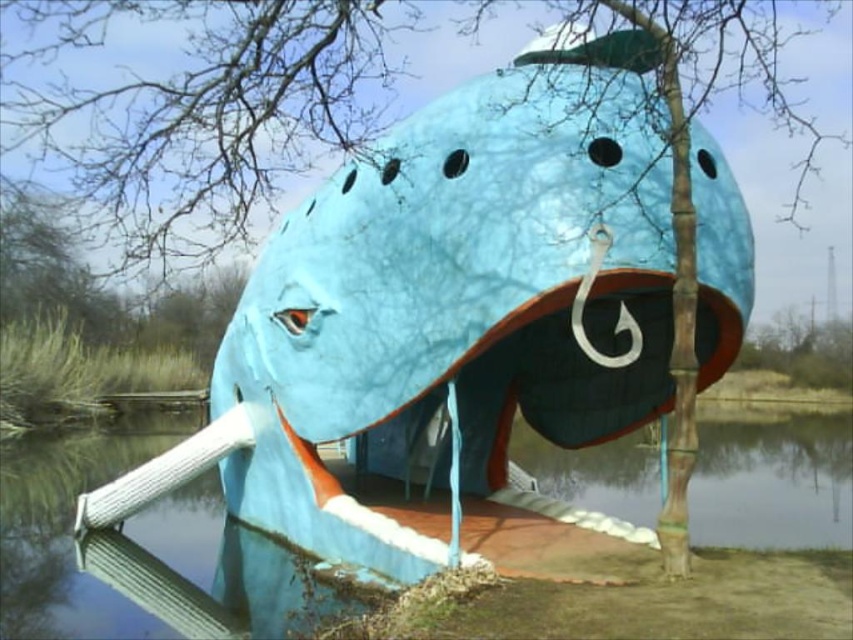
Question: Is green bamboo tree at upper center positioned at the back of blue plastic water at lower center?

Choices:
 (A) yes
 (B) no

Answer: (B)

Question: Is green bamboo tree at upper center below blue plastic water at lower center?

Choices:
 (A) yes
 (B) no

Answer: (B)

Question: Which point appears closest to the camera in this image?

Choices:
 (A) (763, 472)
 (B) (68, 150)

Answer: (B)

Question: Does green bamboo tree at upper center have a larger size compared to blue plastic water at lower center?

Choices:
 (A) yes
 (B) no

Answer: (A)

Question: Which point appears closest to the camera in this image?

Choices:
 (A) (230, 125)
 (B) (39, 600)

Answer: (A)

Question: Which point appears closest to the camera in this image?

Choices:
 (A) (120, 150)
 (B) (215, 483)

Answer: (A)